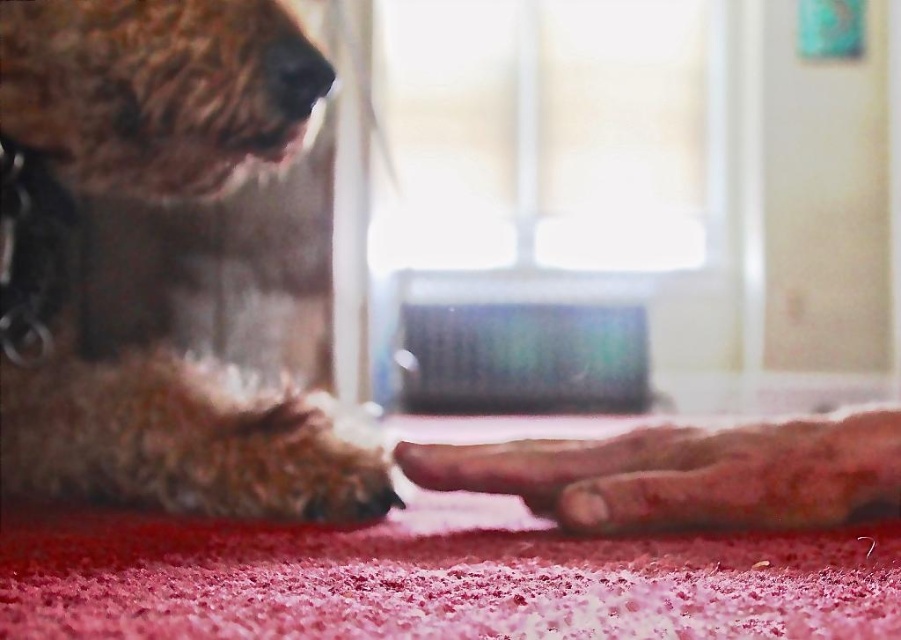
Question: Can you confirm if fuzzy brown dog at left is positioned above fuzzy fur paw at lower center?

Choices:
 (A) yes
 (B) no

Answer: (A)

Question: Does fuzzy brown dog at left have a larger size compared to fuzzy fur paw at lower center?

Choices:
 (A) no
 (B) yes

Answer: (B)

Question: Which of the following is the closest to the observer?

Choices:
 (A) fuzzy fur paw at lower center
 (B) fuzzy brown dog at left

Answer: (A)

Question: Is fuzzy brown dog at left smaller than fuzzy fur paw at lower center?

Choices:
 (A) yes
 (B) no

Answer: (B)

Question: Which object appears closest to the camera in this image?

Choices:
 (A) fuzzy brown dog at left
 (B) fuzzy fur paw at lower center

Answer: (B)